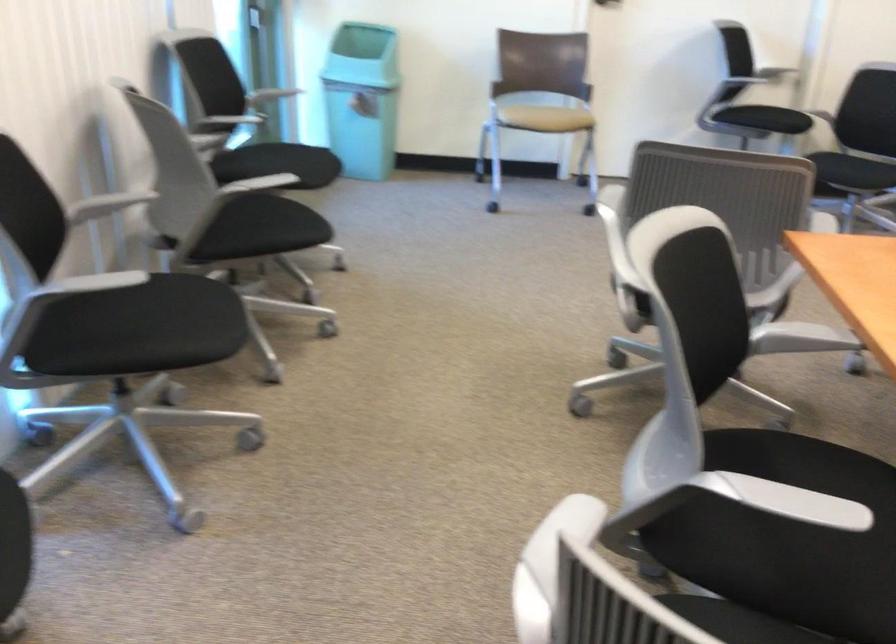
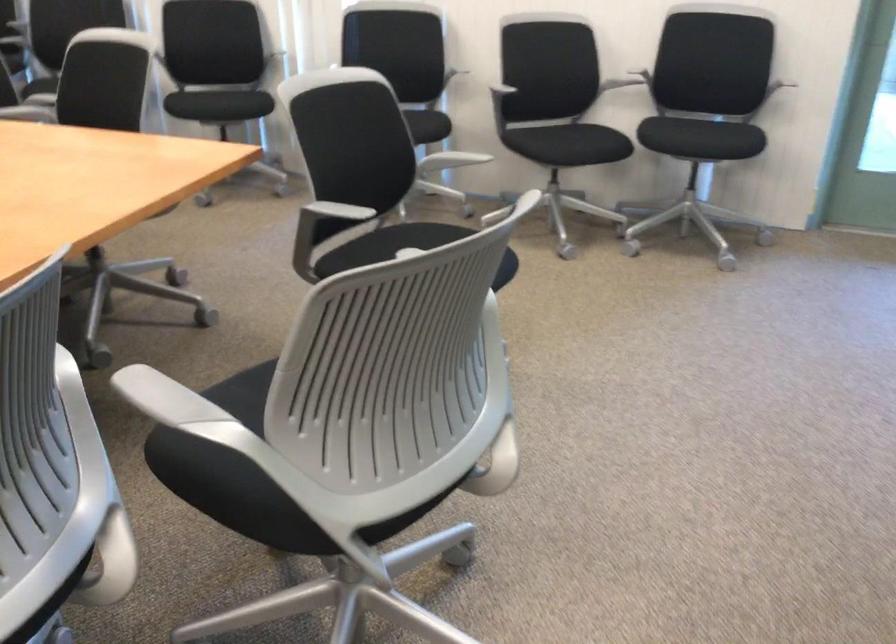
Where in the second image is the point corresponding to the point at 277,228 from the first image?

(579, 144)